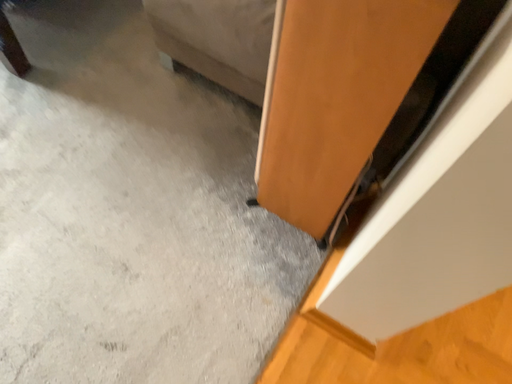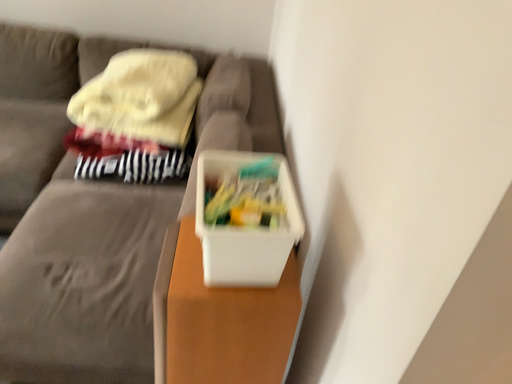
Question: How did the camera likely rotate when shooting the video?

Choices:
 (A) rotated right
 (B) rotated left

Answer: (A)